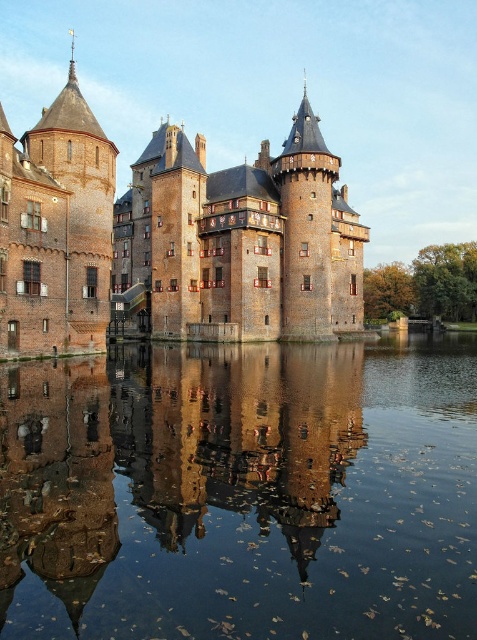
Question: Does smooth brown water at center appear over brick tower at left?

Choices:
 (A) yes
 (B) no

Answer: (B)

Question: Can you confirm if smooth reflective water at center is positioned above brick stone castle at center?

Choices:
 (A) no
 (B) yes

Answer: (A)

Question: Which point appears farthest from the camera in this image?

Choices:
 (A) (51, 193)
 (B) (187, 352)

Answer: (B)

Question: Does smooth brown water at center have a lesser width compared to brick tower at left?

Choices:
 (A) yes
 (B) no

Answer: (A)

Question: Which point is farther to the camera?

Choices:
 (A) (269, 397)
 (B) (65, 312)
 (C) (135, 164)
 (D) (176, 532)

Answer: (C)

Question: Which of the following is the closest to the observer?

Choices:
 (A) smooth reflective water at center
 (B) smooth brown water at center

Answer: (A)